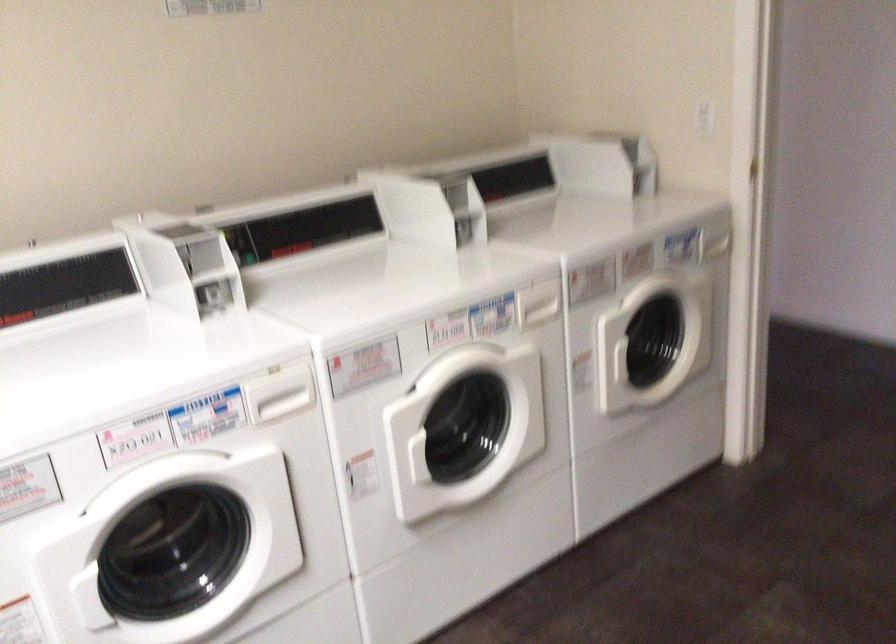
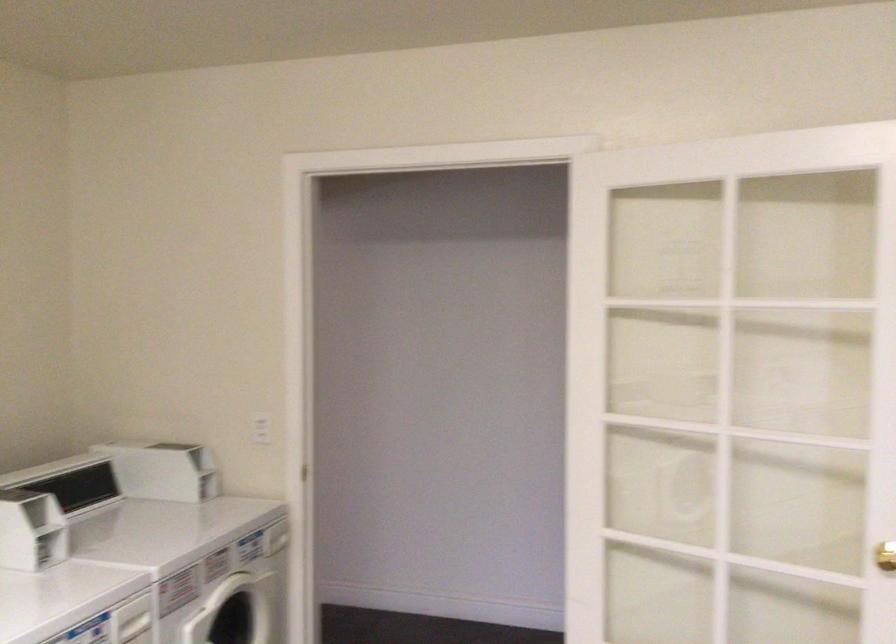
How did the camera likely rotate?

The rotation direction of the camera is right-up.